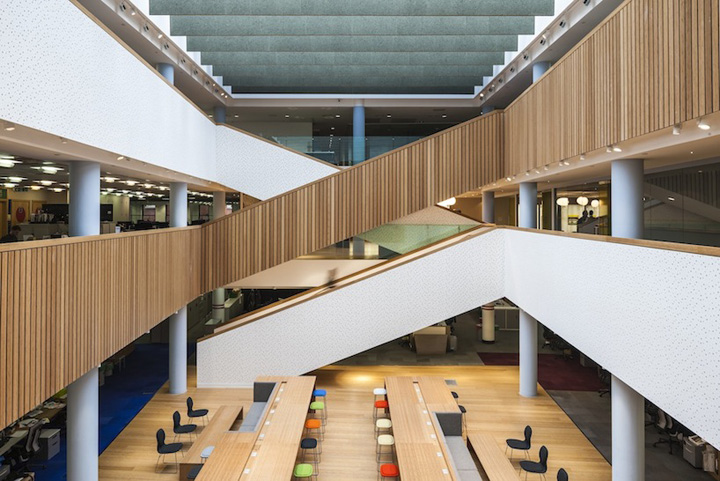
This screenshot has width=720, height=481. I want to click on black chairs, so click(x=512, y=442), click(x=536, y=464), click(x=559, y=478), click(x=168, y=447), click(x=181, y=428), click(x=197, y=409).